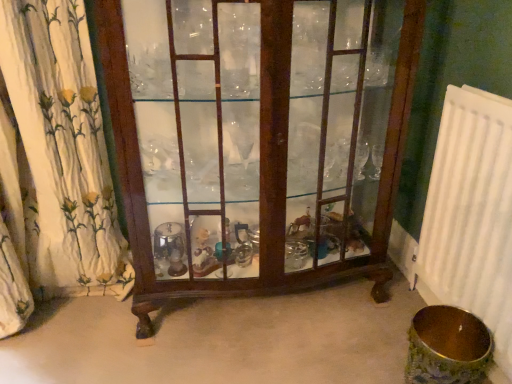
Question: From the image's perspective, is white plastic radiator at right on white floral fabric at left?

Choices:
 (A) yes
 (B) no

Answer: (B)

Question: Does white plastic radiator at right lie in front of white floral fabric at left?

Choices:
 (A) yes
 (B) no

Answer: (A)

Question: Considering the relative positions of white plastic radiator at right and white floral fabric at left in the image provided, is white plastic radiator at right to the left of white floral fabric at left from the viewer's perspective?

Choices:
 (A) yes
 (B) no

Answer: (B)

Question: From the image's perspective, does white plastic radiator at right appear lower than white floral fabric at left?

Choices:
 (A) yes
 (B) no

Answer: (A)

Question: Does white plastic radiator at right turn towards white floral fabric at left?

Choices:
 (A) no
 (B) yes

Answer: (B)

Question: Considering the relative sizes of white plastic radiator at right and white floral fabric at left in the image provided, is white plastic radiator at right wider than white floral fabric at left?

Choices:
 (A) yes
 (B) no

Answer: (B)

Question: From the image's perspective, is mahogany glass cabinet at center on top of white floral fabric at left?

Choices:
 (A) no
 (B) yes

Answer: (B)

Question: Does mahogany glass cabinet at center have a smaller size compared to white floral fabric at left?

Choices:
 (A) yes
 (B) no

Answer: (B)

Question: Is the depth of mahogany glass cabinet at center less than that of white floral fabric at left?

Choices:
 (A) yes
 (B) no

Answer: (A)

Question: From the image's perspective, is mahogany glass cabinet at center located beneath white floral fabric at left?

Choices:
 (A) yes
 (B) no

Answer: (B)

Question: Would you consider mahogany glass cabinet at center to be distant from white floral fabric at left?

Choices:
 (A) no
 (B) yes

Answer: (A)

Question: Would you say mahogany glass cabinet at center is outside white floral fabric at left?

Choices:
 (A) yes
 (B) no

Answer: (A)

Question: Considering the relative positions of white floral fabric at left and white plastic radiator at right in the image provided, is white floral fabric at left to the left of white plastic radiator at right from the viewer's perspective?

Choices:
 (A) no
 (B) yes

Answer: (B)